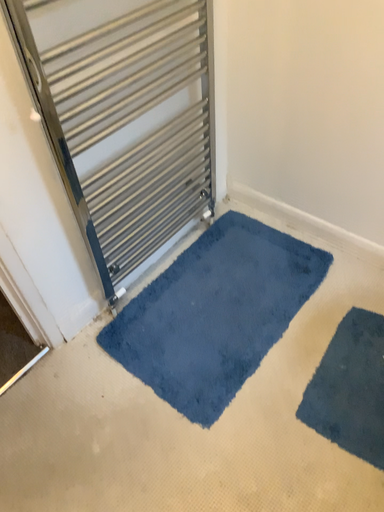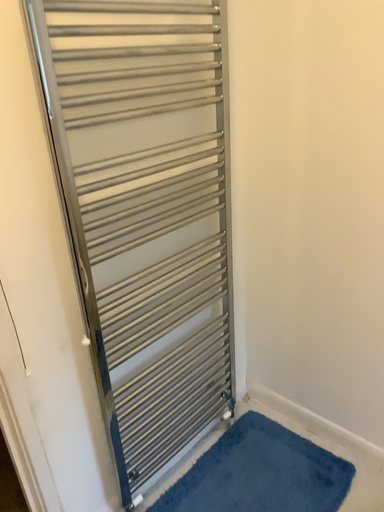
Question: How did the camera likely rotate when shooting the video?

Choices:
 (A) rotated upward
 (B) rotated downward

Answer: (A)